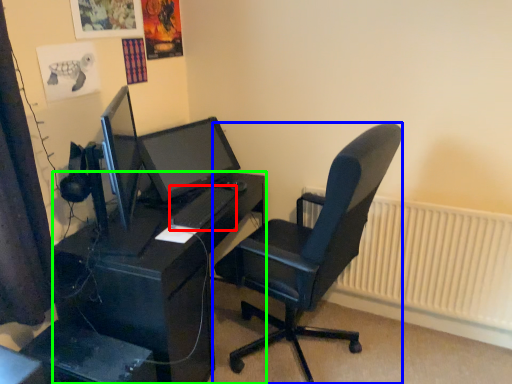
Question: Which is farther away from keyboard (highlighted by a red box)? chair (highlighted by a blue box) or desk (highlighted by a green box)?

Choices:
 (A) chair
 (B) desk

Answer: (A)